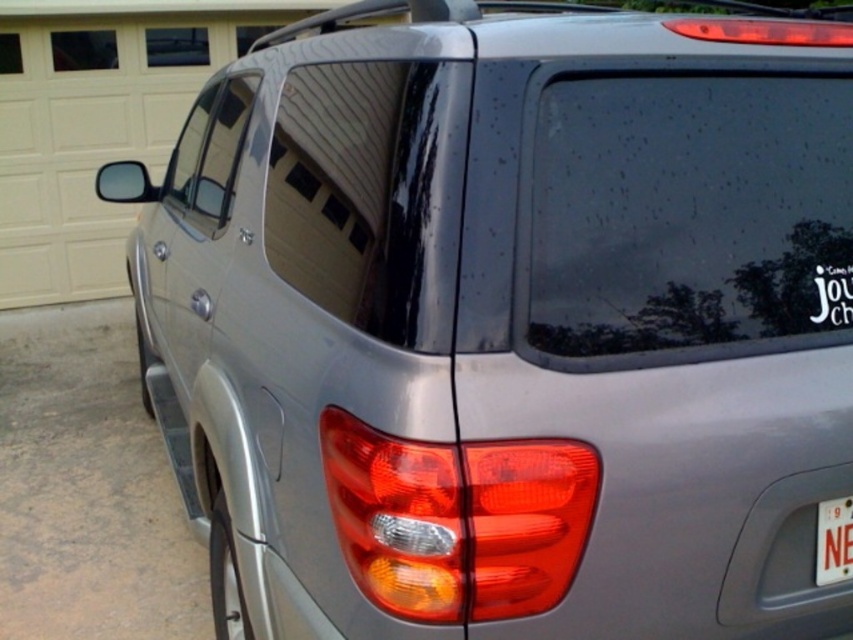
You are a delivery person trying to deliver a package to the address on the white plastic license plate at lower right. The matte plastic tail light at center is blocking the license plate. Can you read the license plate number clearly?

The matte plastic tail light at center is in front of the white plastic license plate at lower right, so the license plate is blocked and the number cannot be read clearly.

You are a delivery person trying to attach a package to the matte plastic tail light at center and the white plastic license plate at lower right. Which object has a larger width?

The matte plastic tail light at center has a larger width than the white plastic license plate at lower right.

Looking at this image, you are standing in front of the silver SUV looking at its rear window. There are two points marked on the window at coordinates point (364, 472) and point (843, 513). Which point is closer to your eyes?

Point (364, 472) is closer to the camera than point (843, 513).